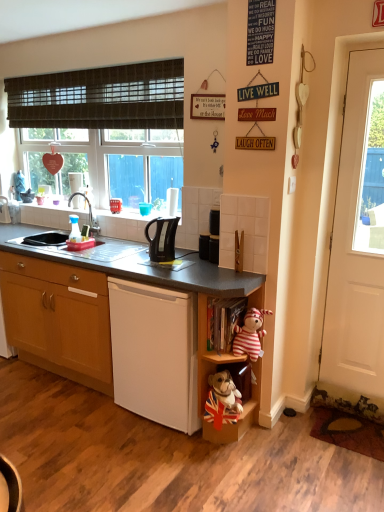
Question: Should I look upward or downward to see striped fabric stuffed animal at lower right?

Choices:
 (A) down
 (B) up

Answer: (A)

Question: From a real-world perspective, does brushed metal faucet at upper left stand above wooden bookshelf at lower center, acting as the second shelf starting from the top?

Choices:
 (A) yes
 (B) no

Answer: (A)

Question: Does brushed metal faucet at upper left have a larger size compared to wooden bookshelf at lower center, acting as the second shelf starting from the top?

Choices:
 (A) no
 (B) yes

Answer: (A)

Question: From the image's perspective, does brushed metal faucet at upper left appear lower than wooden bookshelf at lower center, acting as the second shelf starting from the top?

Choices:
 (A) no
 (B) yes

Answer: (A)

Question: Is brushed metal faucet at upper left located outside wooden bookshelf at lower center, acting as the 1th shelf starting from the bottom?

Choices:
 (A) yes
 (B) no

Answer: (A)

Question: Is brushed metal faucet at upper left thinner than wooden bookshelf at lower center, acting as the second shelf starting from the top?

Choices:
 (A) no
 (B) yes

Answer: (B)

Question: Is brushed metal faucet at upper left not near wooden bookshelf at lower center, acting as the second shelf starting from the top?

Choices:
 (A) no
 (B) yes

Answer: (B)

Question: Does black plastic kettle at center have a greater height compared to black plastic kettle at center?

Choices:
 (A) yes
 (B) no

Answer: (B)

Question: Can you confirm if black plastic kettle at center is shorter than black plastic kettle at center?

Choices:
 (A) no
 (B) yes

Answer: (B)

Question: Can black plastic kettle at center be found inside black plastic kettle at center?

Choices:
 (A) no
 (B) yes

Answer: (A)

Question: Is black plastic kettle at center to the right of black plastic kettle at center from the viewer's perspective?

Choices:
 (A) yes
 (B) no

Answer: (A)

Question: Does black plastic kettle at center have a larger size compared to black plastic kettle at center?

Choices:
 (A) yes
 (B) no

Answer: (B)

Question: Is black plastic kettle at center facing towards black plastic kettle at center?

Choices:
 (A) no
 (B) yes

Answer: (B)

Question: Considering the relative sizes of brushed metal faucet at upper left and wooden cabinet at lower left in the image provided, is brushed metal faucet at upper left wider than wooden cabinet at lower left?

Choices:
 (A) yes
 (B) no

Answer: (B)